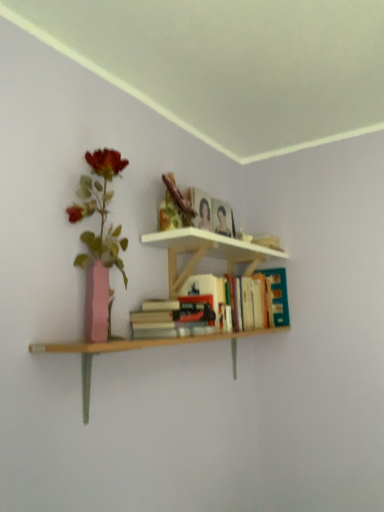
Question: Considering the relative sizes of hardcover book at upper center and hardcover book at center, which ranks as the 1th book in front-to-back order, in the image provided, is hardcover book at upper center shorter than hardcover book at center, which ranks as the 1th book in front-to-back order,?

Choices:
 (A) yes
 (B) no

Answer: (B)

Question: Would you say hardcover book at upper center is outside hardcover book at center, which ranks as the 1th book in front-to-back order?

Choices:
 (A) no
 (B) yes

Answer: (B)

Question: Are hardcover book at upper center and hardcover book at center, acting as the 2th book starting from the back, located far from each other?

Choices:
 (A) yes
 (B) no

Answer: (B)

Question: From a real-world perspective, is hardcover book at upper center under hardcover book at center, acting as the 2th book starting from the back?

Choices:
 (A) no
 (B) yes

Answer: (A)

Question: Does hardcover book at upper center touch hardcover book at center, which ranks as the 1th book in front-to-back order?

Choices:
 (A) no
 (B) yes

Answer: (A)

Question: Does hardcover book at upper center have a smaller size compared to hardcover book at center, which ranks as the 1th book in front-to-back order?

Choices:
 (A) no
 (B) yes

Answer: (B)

Question: From a real-world perspective, is hardcover book at center, which ranks as the 1th book in front-to-back order, over hardcover book at upper center?

Choices:
 (A) no
 (B) yes

Answer: (A)

Question: Is the position of hardcover book at center, acting as the 2th book starting from the back, less distant than that of hardcover book at upper center?

Choices:
 (A) no
 (B) yes

Answer: (B)

Question: Is hardcover book at center, acting as the 2th book starting from the back, located outside hardcover book at upper center?

Choices:
 (A) no
 (B) yes

Answer: (B)

Question: Considering the relative positions of hardcover book at center, which ranks as the 1th book in front-to-back order, and hardcover book at upper center in the image provided, is hardcover book at center, which ranks as the 1th book in front-to-back order, behind hardcover book at upper center?

Choices:
 (A) yes
 (B) no

Answer: (B)

Question: Considering the relative positions of hardcover book at center, acting as the 2th book starting from the back, and hardcover book at upper center in the image provided, is hardcover book at center, acting as the 2th book starting from the back, to the left of hardcover book at upper center from the viewer's perspective?

Choices:
 (A) no
 (B) yes

Answer: (B)

Question: Could you tell me if hardcover book at center, which ranks as the 1th book in front-to-back order, is facing hardcover book at upper center?

Choices:
 (A) no
 (B) yes

Answer: (A)

Question: Does hardcover book at upper right, the second book when ordered from front to back, have a lesser height compared to hardcover book at center, acting as the 2th book starting from the back?

Choices:
 (A) yes
 (B) no

Answer: (B)